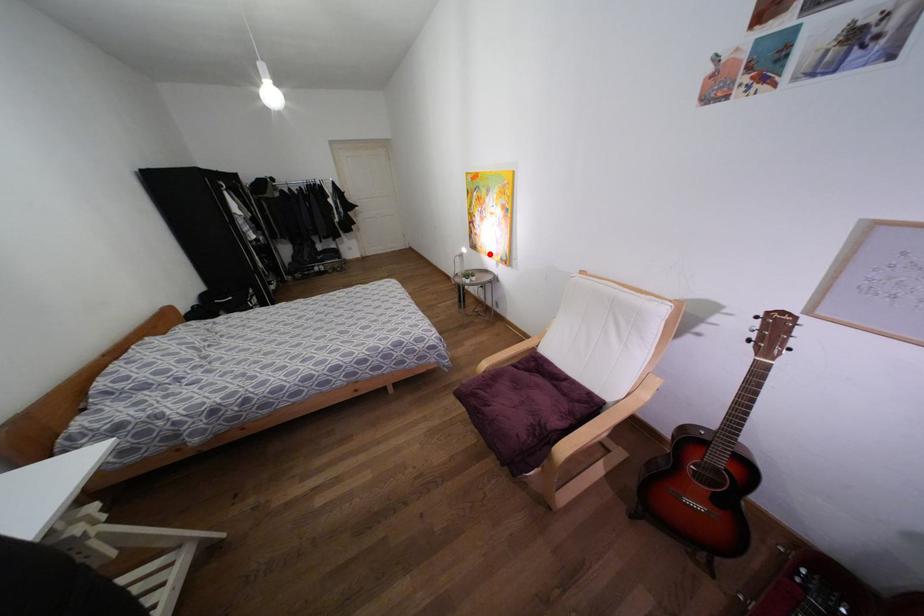
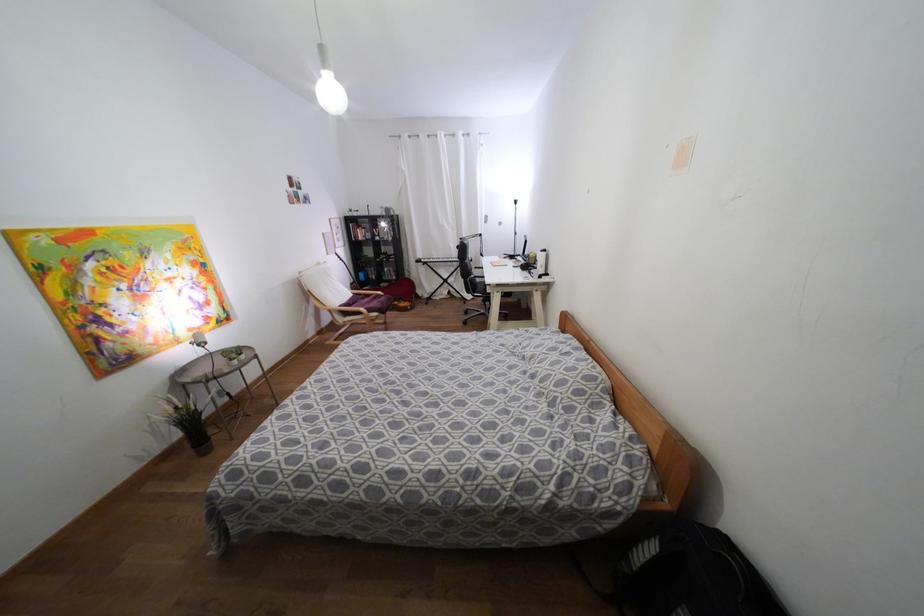
The point at the highlighted location is marked in the first image. Where is the corresponding point in the second image?

(190, 333)